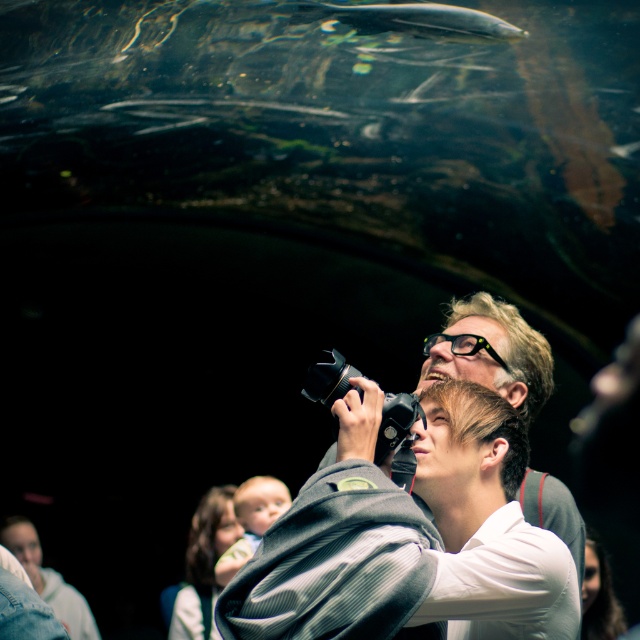
You are standing in the aquarium tunnel and want to take a photo of the two points marked in the scene. Which point, point (298, 604) or point (360, 13), is closer to you?

Point (298, 604) is closer to the camera than point (360, 13), so it is closer to you.

Consider the image. You are a photographer standing in the aquarium tunnel. You notice the matte gray jacket at center and the silvery smooth fish at upper center. Can you take a photo of both objects in the same frame without moving your position? Explain why or why not based on their distance.

The matte gray jacket at center and silvery smooth fish at upper center are 9.00 feet apart from each other. Since the distance between them is 9 feet, which is relatively large, it might be challenging to capture both in the same frame without moving your position. However, this depends on the camera lens used. A wide angle lens could potentially include both objects if they are within the field of view, but a standard or telephoto lens might not. Without knowing the specific lens capabilities, it is hard